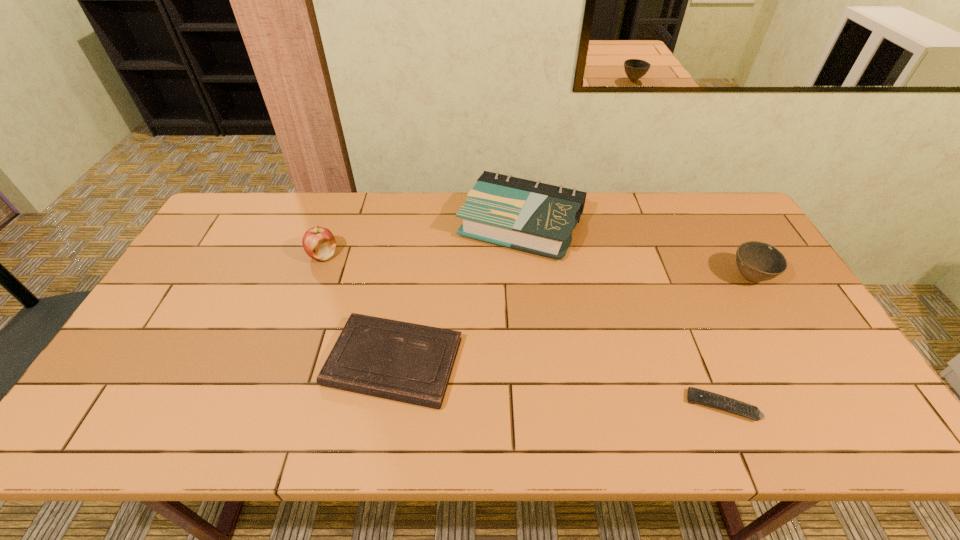
At what (x,y) coordinates should I click in order to perform the action: click on the taller paperback book. Please return your answer as a coordinate pair (x, y). The height and width of the screenshot is (540, 960). Looking at the image, I should click on (535, 217).

I want to click on apple, so click(x=319, y=243).

Where is `the third shortest object`? This screenshot has width=960, height=540. the third shortest object is located at coordinates (757, 261).

Locate an element on the screen. the rightmost object is located at coordinates coord(757,261).

You are a GUI agent. You are given a task and a screenshot of the screen. Output one action in this format:
    pyautogui.click(x=<x>, y=<y>)
    Task: Click on the fourth tallest object
    
    Given the screenshot: What is the action you would take?
    [406, 362]

Where is `the nearer paperback book`? the nearer paperback book is located at coordinates (406, 362).

This screenshot has height=540, width=960. Find the location of `the shortest object`. the shortest object is located at coordinates (694, 395).

Image resolution: width=960 pixels, height=540 pixels. Identify the location of remote control. (694, 395).

Image resolution: width=960 pixels, height=540 pixels. Identify the location of vacant space situated on the front of the farther paperback book. (529, 298).

The image size is (960, 540). I want to click on free location located on the front of the leftmost object, so tap(312, 285).